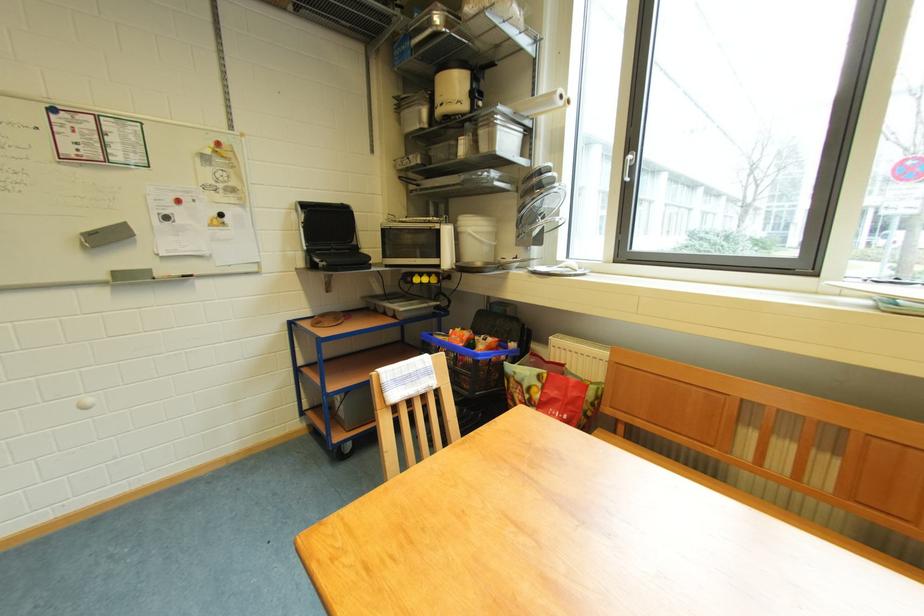
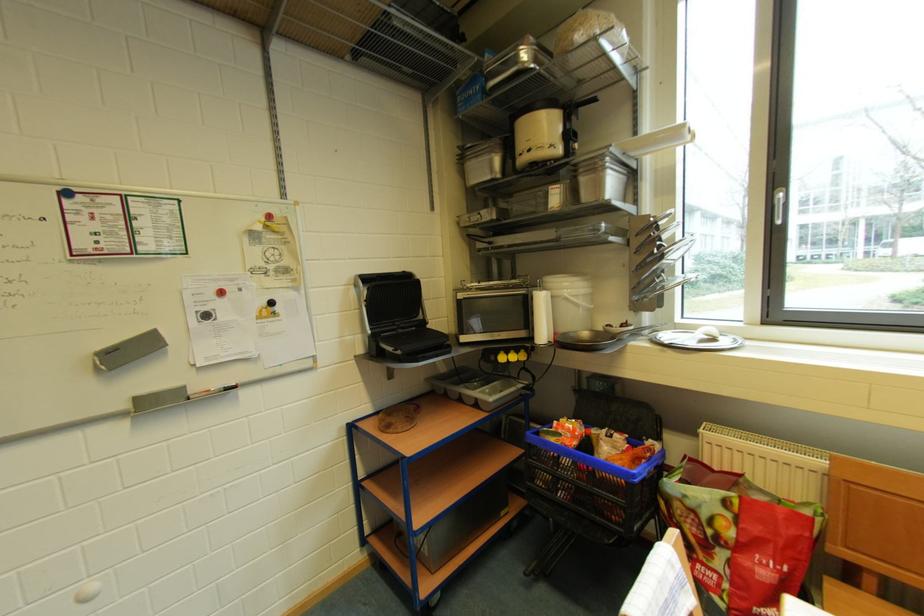
In the second image, find the point that corresponds to point 587,270 in the first image.

(730, 339)